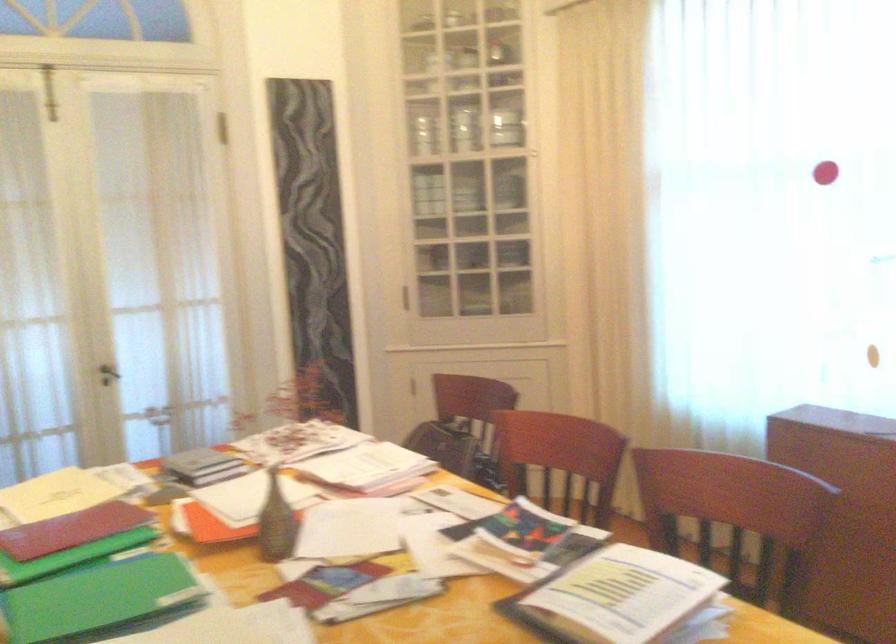
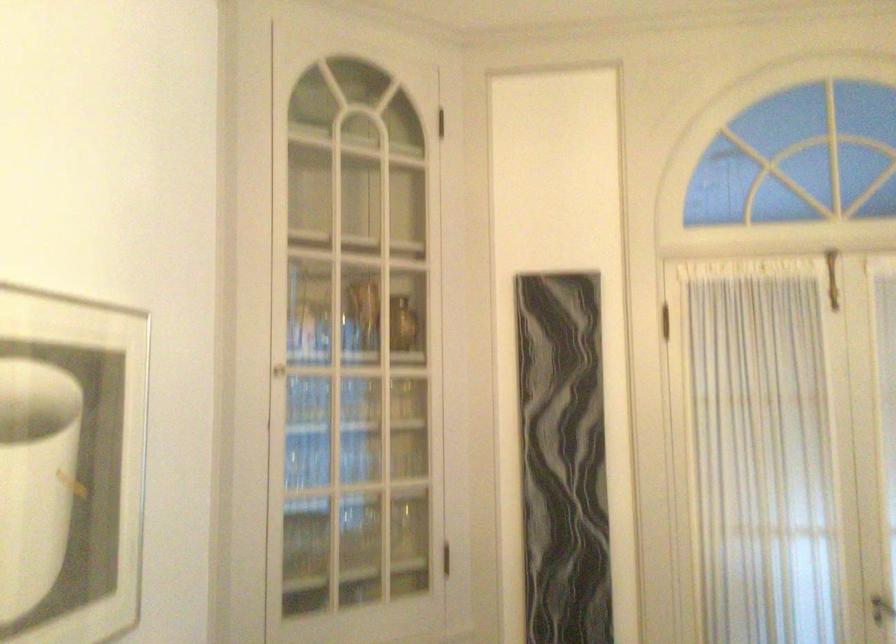
Locate, in the second image, the point that corresponds to pixel 108 377 in the first image.

(882, 609)